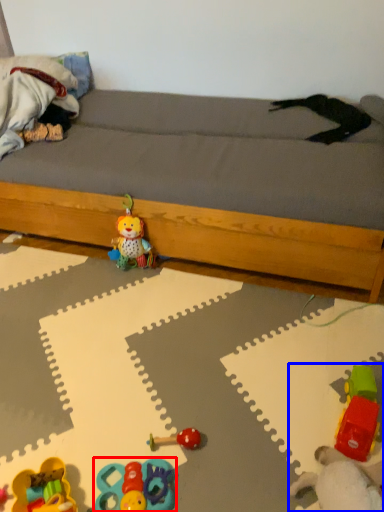
Question: Among these objects, which one is nearest to the camera, toy (highlighted by a red box) or toy (highlighted by a blue box)?

Choices:
 (A) toy
 (B) toy

Answer: (B)